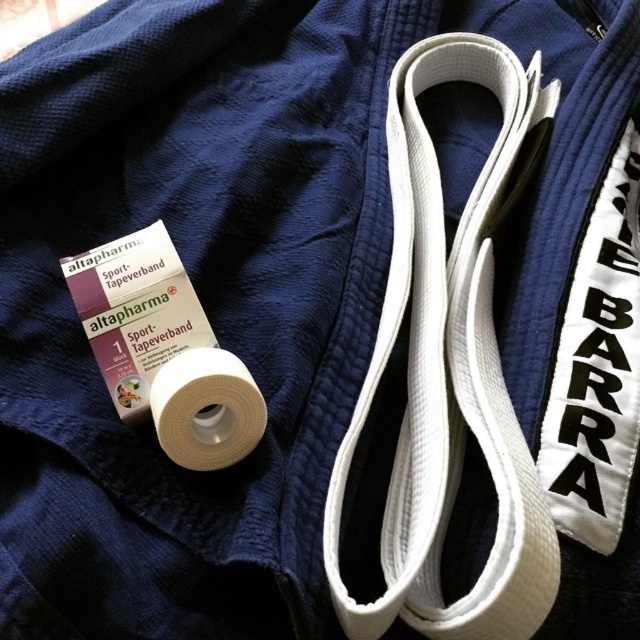
Question: Does white fabric strap at center have a larger size compared to white matte tape at lower left?

Choices:
 (A) no
 (B) yes

Answer: (B)

Question: Among these points, which one is nearest to the camera?

Choices:
 (A) (412, 340)
 (B) (182, 401)

Answer: (B)

Question: Which object is farther from the camera taking this photo?

Choices:
 (A) white fabric strap at center
 (B) white matte tape at lower left

Answer: (B)

Question: In this image, where is white fabric strap at center located relative to white matte tape at lower left?

Choices:
 (A) above
 (B) below

Answer: (A)

Question: Is white fabric strap at center thinner than white matte tape at lower left?

Choices:
 (A) no
 (B) yes

Answer: (A)

Question: Which of the following is the farthest from the observer?

Choices:
 (A) white fabric strap at center
 (B) white matte tape at lower left

Answer: (B)